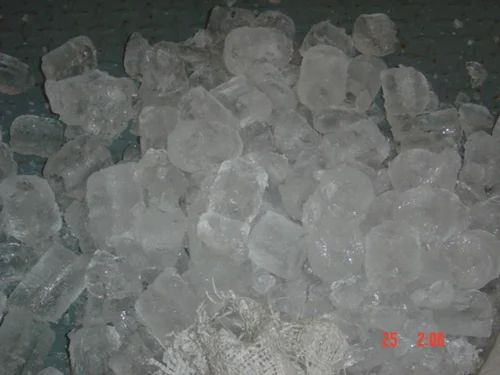
The image size is (500, 375). I want to click on dark speck on table surface, so click(x=126, y=25).